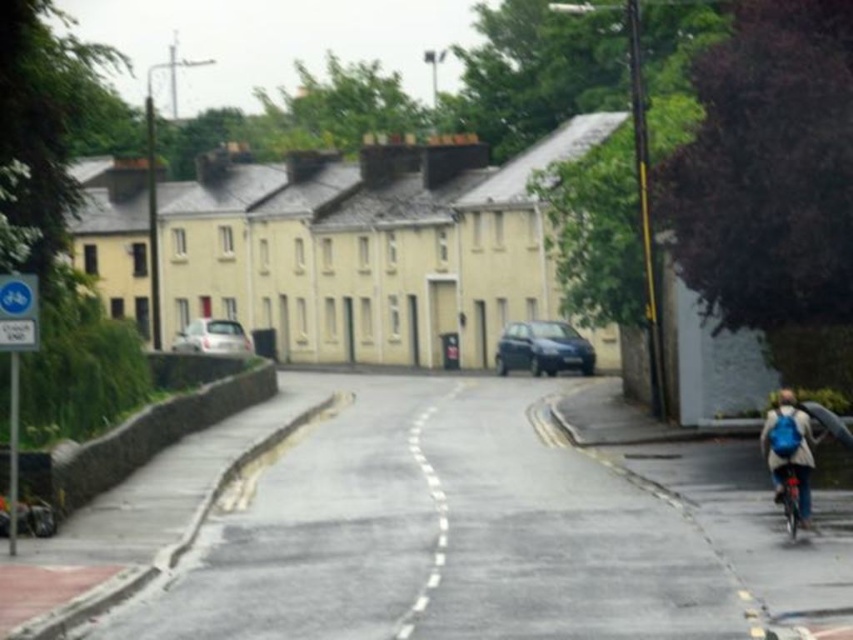
Does white glossy car at center have a greater width compared to metallic blue bicycle at lower right?

Yes.

Can you confirm if white glossy car at center is positioned to the left of metallic blue bicycle at lower right?

Correct, you'll find white glossy car at center to the left of metallic blue bicycle at lower right.

Is point (216, 326) closer to viewer compared to point (786, 522)?

No, (216, 326) is further to viewer.

Where is `white glossy car at center`? white glossy car at center is located at coordinates (213, 337).

Between gray asphalt bike lane at center and white glossy car at center, which one has less height?

gray asphalt bike lane at center is shorter.

Which is more to the right, gray asphalt bike lane at center or white glossy car at center?

From the viewer's perspective, gray asphalt bike lane at center appears more on the right side.

Which is in front, point (144, 628) or point (239, 353)?

Point (144, 628) is more forward.

You are a GUI agent. You are given a task and a screenshot of the screen. Output one action in this format:
    pyautogui.click(x=<x>, y=<y>)
    Task: Click on the gray asphalt bike lane at center
    
    Given the screenshot: What is the action you would take?
    pyautogui.click(x=438, y=532)

Does dark blue metallic car at center appear over metallic blue bicycle at lower right?

Yes.

Between dark blue metallic car at center and metallic blue bicycle at lower right, which one is positioned lower?

Positioned lower is metallic blue bicycle at lower right.

Is point (537, 326) closer to viewer compared to point (785, 476)?

No.

Find the location of `dark blue metallic car at center`. dark blue metallic car at center is located at coordinates (543, 348).